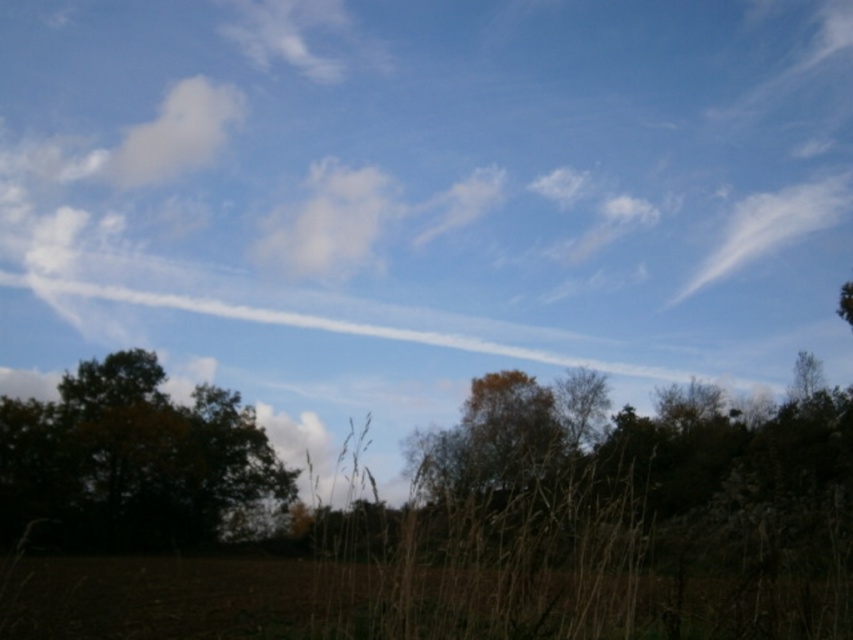
You are an airplane pilot observing the sky. You notice the white fluffy cloud at center and the white cotton cloud at upper right. Which of these clouds has a smaller width?

The white fluffy cloud at center has a smaller width than the white cotton cloud at upper right.

You are an artist trying to paint the scene. You notice the brown leafy tree at lower left and the white fluffy cloud at upper left. Which object should you paint first if you want to follow the rule of painting smaller objects before larger ones?

The brown leafy tree at lower left should be painted first because its width is smaller than the white fluffy cloud at upper left.